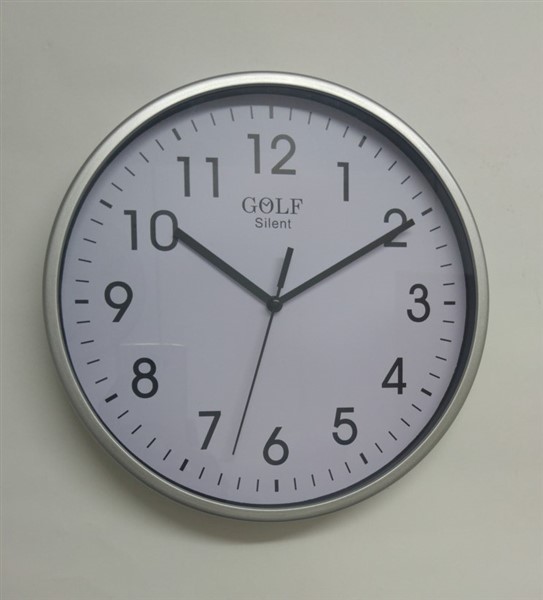
Find the location of a particular element. This screenshot has height=600, width=543. inside face of frame is located at coordinates (390, 131).